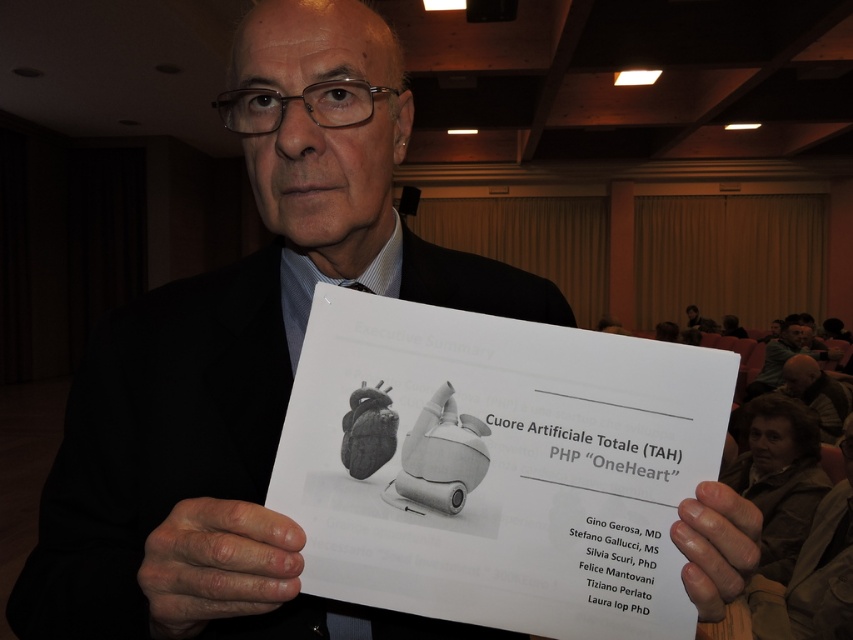
Question: Which object appears closest to the camera in this image?

Choices:
 (A) smooth skin at center
 (B) gray matte heart at lower right

Answer: (A)

Question: Which point appears farthest from the camera in this image?

Choices:
 (A) (798, 406)
 (B) (288, 573)

Answer: (A)

Question: Is smooth skin at center closer to camera compared to gray hair at upper right?

Choices:
 (A) yes
 (B) no

Answer: (A)

Question: Does dry skin at center appear under smooth skin at center?

Choices:
 (A) yes
 (B) no

Answer: (A)

Question: Does gray matte heart at lower right appear over gray hair at upper right?

Choices:
 (A) no
 (B) yes

Answer: (A)

Question: Which point is farther to the camera?

Choices:
 (A) (717, 564)
 (B) (764, 362)

Answer: (B)